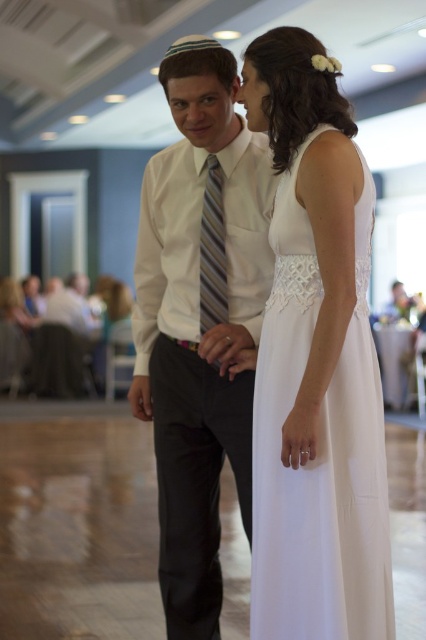
Who is more distant from viewer, (293, 244) or (163, 83)?

Point (163, 83)

Is white lace dress at center shorter than matte white forehead at upper center?

Incorrect, white lace dress at center's height does not fall short of matte white forehead at upper center's.

This screenshot has height=640, width=426. Describe the element at coordinates (319, 449) in the screenshot. I see `white lace dress at center` at that location.

Find the location of a particular element. This screenshot has height=640, width=426. white lace dress at center is located at coordinates (319, 449).

Who is taller, striped fabric tie at center or matte white forehead at upper center?

striped fabric tie at center is taller.

Is striped fabric tie at center to the left of matte white forehead at upper center from the viewer's perspective?

In fact, striped fabric tie at center is to the right of matte white forehead at upper center.

Which is in front, point (221, 312) or point (189, 93)?

Point (189, 93) is more forward.

This screenshot has height=640, width=426. Identify the location of striped fabric tie at center. (213, 252).

Does white satin shirt at center have a greater width compared to matte white forehead at upper center?

Yes, white satin shirt at center is wider than matte white forehead at upper center.

The image size is (426, 640). In order to click on white satin shirt at center in this screenshot , I will do `click(199, 324)`.

You are a GUI agent. You are given a task and a screenshot of the screen. Output one action in this format:
    pyautogui.click(x=<x>, y=<y>)
    Task: Click on the white satin shirt at center
    
    Given the screenshot: What is the action you would take?
    pyautogui.click(x=199, y=324)

You are a GUI agent. You are given a task and a screenshot of the screen. Output one action in this format:
    pyautogui.click(x=<x>, y=<y>)
    Task: Click on the white satin shirt at center
    
    Given the screenshot: What is the action you would take?
    pyautogui.click(x=199, y=324)